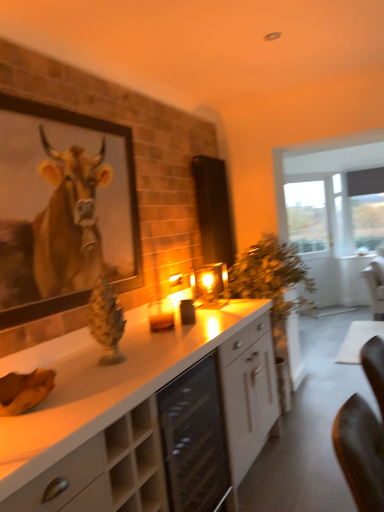
Question: Does matte black screen door at center contain white glossy cabinet at center, positioned as the first cabinetry in back-to-front order?

Choices:
 (A) no
 (B) yes

Answer: (A)

Question: Is matte black screen door at center taller than white glossy cabinet at center, acting as the 2th cabinetry starting from the front?

Choices:
 (A) no
 (B) yes

Answer: (B)

Question: Is matte black screen door at center positioned before white glossy cabinet at center, acting as the 2th cabinetry starting from the front?

Choices:
 (A) yes
 (B) no

Answer: (B)

Question: From the image's perspective, does matte black screen door at center appear higher than white glossy cabinet at center, positioned as the first cabinetry in back-to-front order?

Choices:
 (A) yes
 (B) no

Answer: (A)

Question: Is matte black screen door at center not near white glossy cabinet at center, acting as the 2th cabinetry starting from the front?

Choices:
 (A) yes
 (B) no

Answer: (A)

Question: Is white glossy cabinet at center, acting as the 2th cabinetry starting from the front, at the back of matte black screen door at center?

Choices:
 (A) no
 (B) yes

Answer: (B)

Question: Is transparent glass door at right in contact with wooden framed cow portrait at upper left?

Choices:
 (A) yes
 (B) no

Answer: (B)

Question: From a real-world perspective, is transparent glass door at right positioned over wooden framed cow portrait at upper left based on gravity?

Choices:
 (A) no
 (B) yes

Answer: (A)

Question: Is transparent glass door at right further to camera compared to wooden framed cow portrait at upper left?

Choices:
 (A) no
 (B) yes

Answer: (B)

Question: Is the position of transparent glass door at right less distant than that of wooden framed cow portrait at upper left?

Choices:
 (A) no
 (B) yes

Answer: (A)

Question: From the image's perspective, would you say transparent glass door at right is shown under wooden framed cow portrait at upper left?

Choices:
 (A) no
 (B) yes

Answer: (B)

Question: Can you confirm if transparent glass door at right is positioned to the left of wooden framed cow portrait at upper left?

Choices:
 (A) yes
 (B) no

Answer: (B)

Question: From the image's perspective, is matte black screen door at center beneath beige wood cabinet at lower left, the second cabinetry positioned from the back?

Choices:
 (A) no
 (B) yes

Answer: (A)